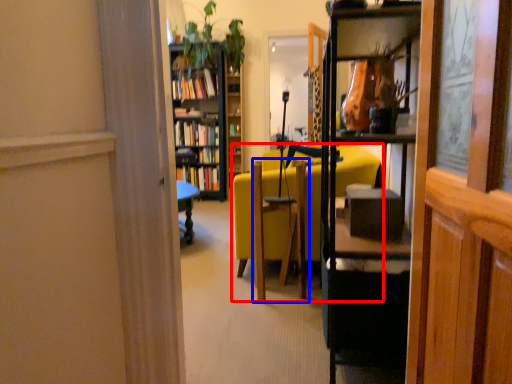
Question: Which object is further to the camera taking this photo, chair (highlighted by a red box) or swivel chair (highlighted by a blue box)?

Choices:
 (A) chair
 (B) swivel chair

Answer: (A)